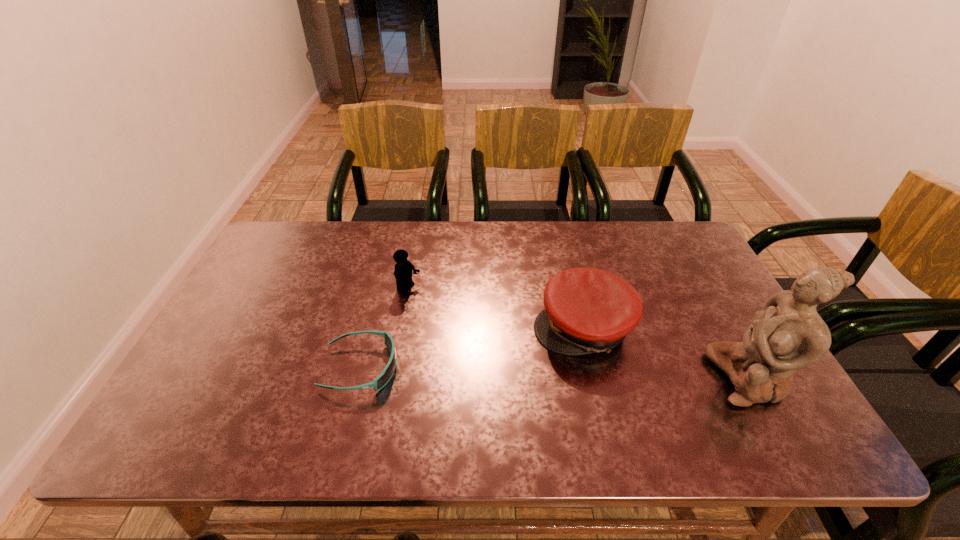
Locate an element on the screen. The height and width of the screenshot is (540, 960). vacant region between the sunglasses and the cap is located at coordinates (471, 348).

The image size is (960, 540). Find the location of `vacant area that lies between the Lego and the sunglasses`. vacant area that lies between the Lego and the sunglasses is located at coordinates (385, 329).

Select which object is the third closest to the Lego. Please provide its 2D coordinates. Your answer should be formatted as a tuple, i.e. [(x, y)], where the tuple contains the x and y coordinates of a point satisfying the conditions above.

[(789, 334)]

Locate which object ranks second in proximity to the rightmost object. Please provide its 2D coordinates. Your answer should be formatted as a tuple, i.e. [(x, y)], where the tuple contains the x and y coordinates of a point satisfying the conditions above.

[(403, 269)]

Where is `blank space that satisfies the following two spatial constraints: 1. on the front side of the tallest object; 2. on the front-facing side of the Lego`? This screenshot has height=540, width=960. blank space that satisfies the following two spatial constraints: 1. on the front side of the tallest object; 2. on the front-facing side of the Lego is located at coordinates (393, 377).

Locate an element on the screen. This screenshot has height=540, width=960. blank area in the image that satisfies the following two spatial constraints: 1. on the front side of the Lego; 2. on the right side of the cap is located at coordinates (402, 328).

Locate an element on the screen. free region that satisfies the following two spatial constraints: 1. on the front side of the cap; 2. on the front-facing side of the tallest object is located at coordinates (595, 377).